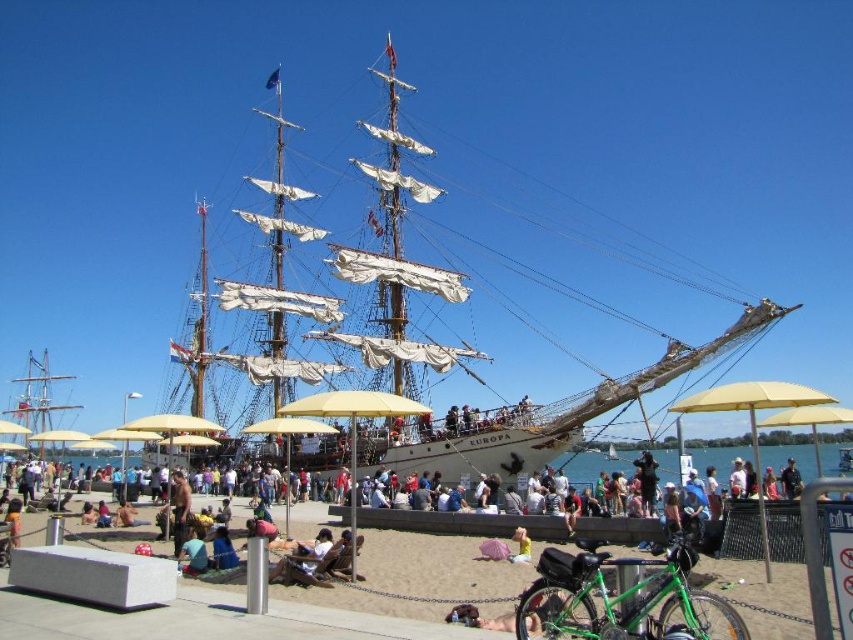
Question: Which point is closer to the camera?

Choices:
 (A) wooden ship at center
 (B) light brown fabric at lower center

Answer: (A)

Question: Which point is closer to the camera taking this photo?

Choices:
 (A) (192, 570)
 (B) (750, 586)
 (C) (387, 272)
 (D) (848, 416)

Answer: (B)

Question: From the image, what is the correct spatial relationship of light brown fabric at lower center in relation to blue fabric bag at lower center?

Choices:
 (A) right
 (B) left

Answer: (A)

Question: Does light brown fabric at lower center come behind blue fabric bag at lower center?

Choices:
 (A) yes
 (B) no

Answer: (B)

Question: Which of the following is the closest to the observer?

Choices:
 (A) (421, 198)
 (B) (821, 396)
 (C) (198, 621)
 (D) (187, 540)

Answer: (C)

Question: Can you confirm if sand at lower center is positioned above yellow fabric umbrella at lower right?

Choices:
 (A) no
 (B) yes

Answer: (A)